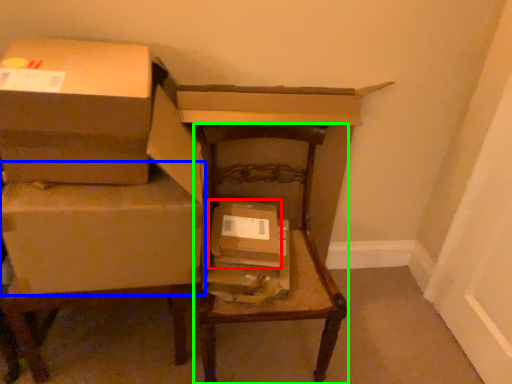
Question: Which is farther away from box (highlighted by a red box)? box (highlighted by a blue box) or furniture (highlighted by a green box)?

Choices:
 (A) box
 (B) furniture

Answer: (A)